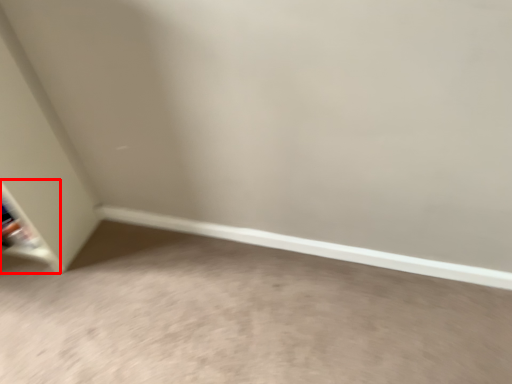
Question: Considering the relative positions of shelf (annotated by the red box) and concrete in the image provided, where is shelf (annotated by the red box) located with respect to the staircase?

Choices:
 (A) left
 (B) right

Answer: (A)